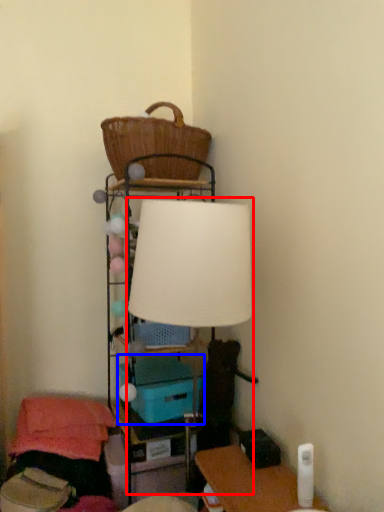
Question: Which of the following is the farthest to the observer, lamp (highlighted by a red box) or storage box (highlighted by a blue box)?

Choices:
 (A) lamp
 (B) storage box

Answer: (B)